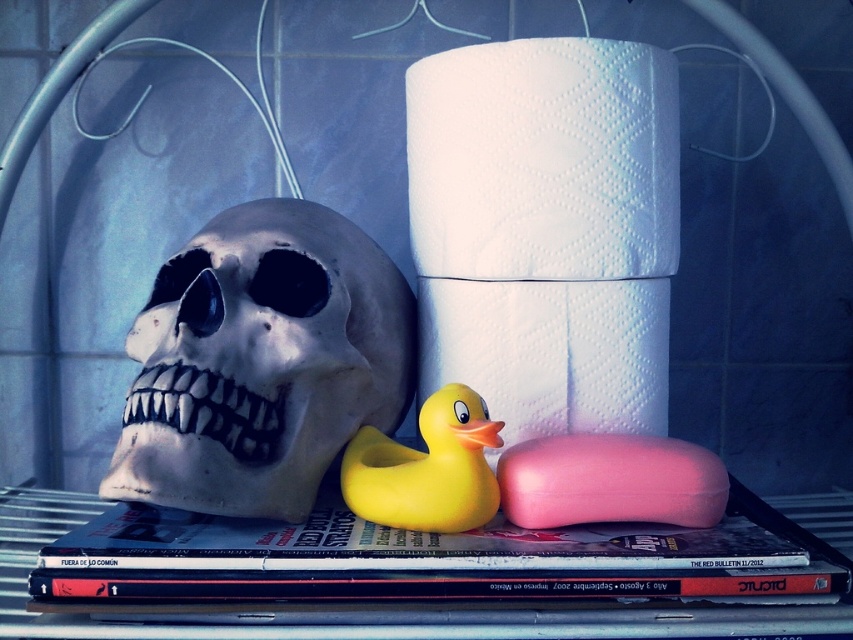
You are organizing items on a shelf and need to know the arrangement between the white matte skull at left and the hardcover book at center. Which object is positioned higher on the shelf?

The white matte skull at left is positioned higher than the hardcover book at center because it is above it.

You are an interior designer arranging items on a metal shelf. You notice a point marked at coordinates [260,362]. What object is located at that point?

The point at coordinates [260,362] indicates the location of the white matte skull at left.

You are organizing items on a shelf and need to place a new item between the hardcover book at center and the yellow rubber duck at center. Where should you place it to ensure it is between them?

The hardcover book at center is positioned on the right side of the yellow rubber duck at center, so placing the new item between them would require placing it to the right of the yellow rubber duck at center and to the left of the hardcover book at center.